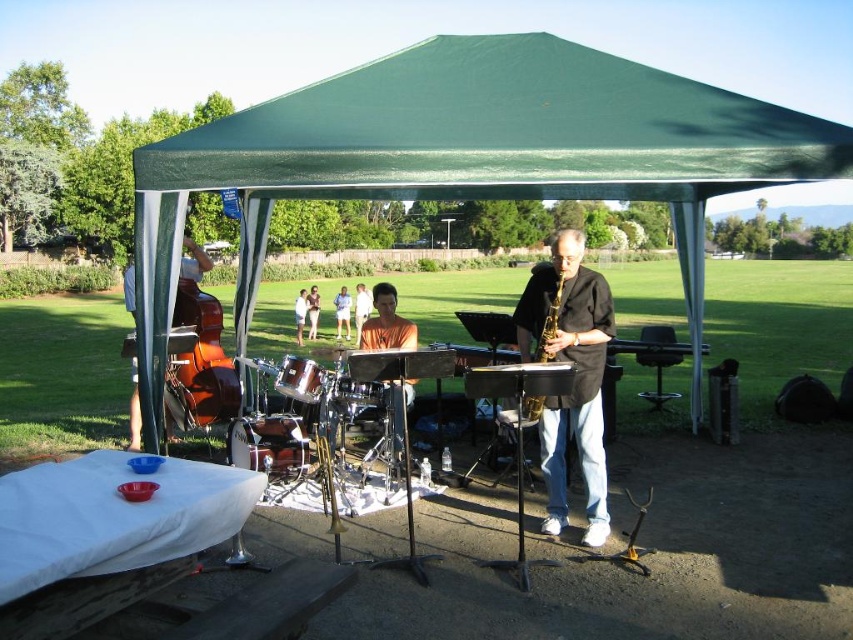
Who is positioned more to the right, green fabric canopy at upper center or orange fabric at center?

green fabric canopy at upper center is more to the right.

Who is shorter, green fabric canopy at upper center or orange fabric at center?

green fabric canopy at upper center is shorter.

Where is `green fabric canopy at upper center`? The image size is (853, 640). green fabric canopy at upper center is located at coordinates (500, 131).

Who is positioned more to the left, green fabric tent at center or shiny brown cello at left?

shiny brown cello at left

Does green fabric tent at center come in front of shiny brown cello at left?

Yes, green fabric tent at center is closer to the viewer.

The width and height of the screenshot is (853, 640). What do you see at coordinates (473, 156) in the screenshot? I see `green fabric tent at center` at bounding box center [473, 156].

Find the location of a particular element. green fabric tent at center is located at coordinates pyautogui.click(x=473, y=156).

Is smooth brown leather jacket at center thinner than orange fabric dress at center?

Yes.

Which is in front, point (357, 316) or point (305, 308)?

Positioned in front is point (357, 316).

Identify the location of smooth brown leather jacket at center. This screenshot has height=640, width=853. (361, 308).